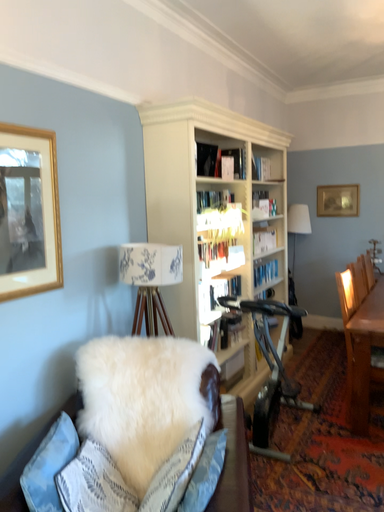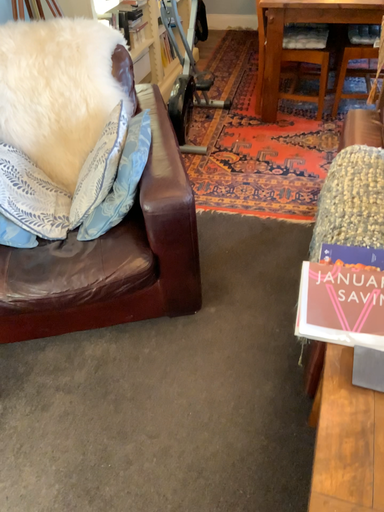
Question: Which way did the camera rotate in the video?

Choices:
 (A) rotated upward
 (B) rotated downward

Answer: (B)